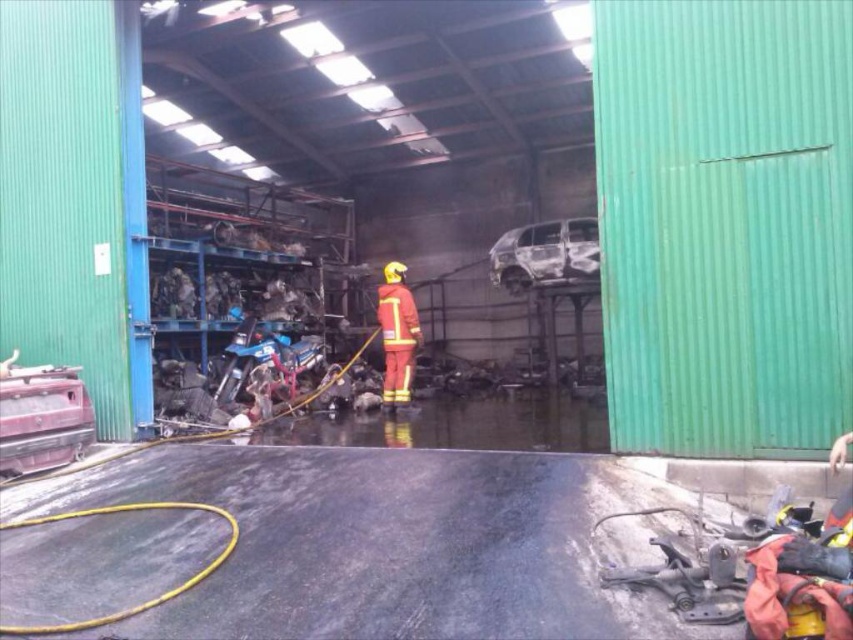
You are a safety inspector in this industrial space. You need to ensure that the burnt metallic car at center and the red matte fireman at center are positioned safely. Based on their sizes, which object takes up more space in the area?

The burnt metallic car at center takes up more space in the area because it has a larger size compared to the red matte fireman at center.

You are a safety inspector in this industrial space. You need to ensure that the burnt metallic car at center and the red matte fireman at center are positioned safely. Based on their heights, which object is shorter?

The burnt metallic car at center is shorter than the red matte fireman at center, so the burnt metallic car at center is the shorter object.